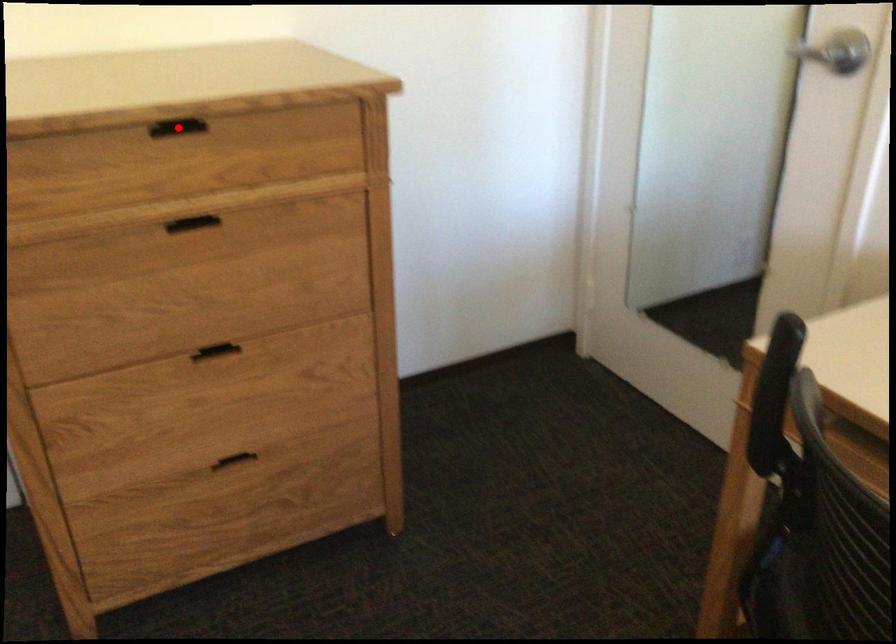
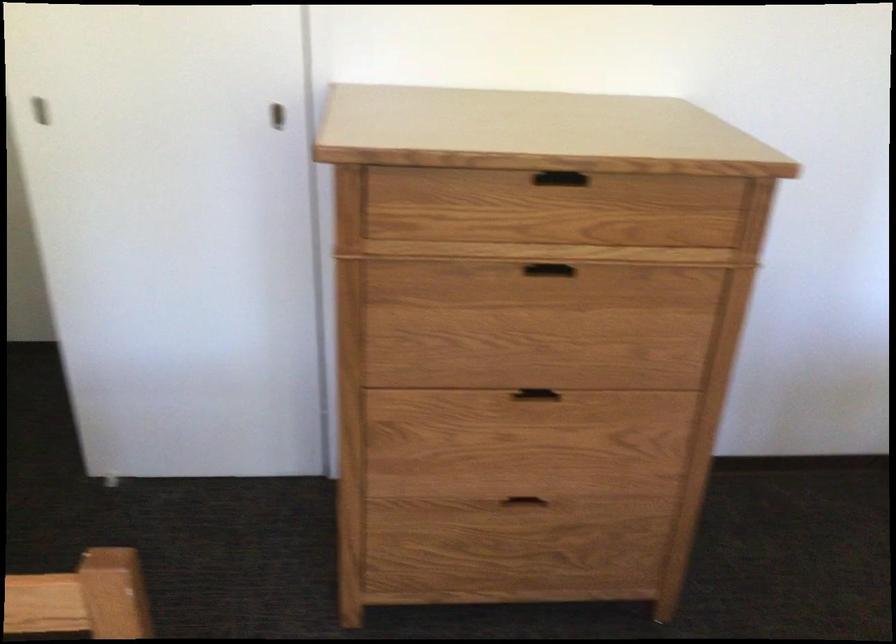
Question: I am providing you with two images of the same scene from different viewpoints. A red point is shown in image1. For the corresponding object point in image2, is it positioned nearer or farther from the camera?

Choices:
 (A) Nearer
 (B) Farther

Answer: (A)